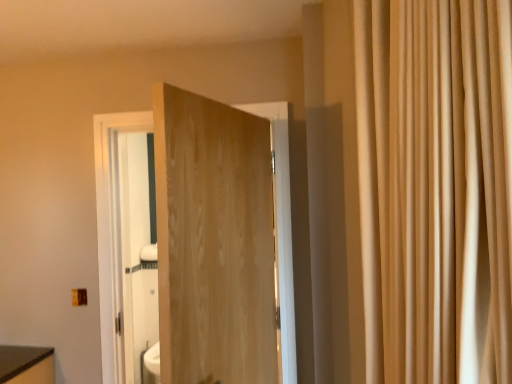
Question: From a real-world perspective, relative to natural wood door at center, is beige fabric curtain at right vertically above or below?

Choices:
 (A) above
 (B) below

Answer: (A)

Question: From the image's perspective, is beige fabric curtain at right positioned above or below natural wood door at center?

Choices:
 (A) above
 (B) below

Answer: (A)

Question: Is beige fabric curtain at right wider or thinner than natural wood door at center?

Choices:
 (A) wide
 (B) thin

Answer: (A)

Question: From a real-world perspective, is natural wood door at center above or below beige fabric curtain at right?

Choices:
 (A) above
 (B) below

Answer: (B)

Question: Considering the positions of natural wood door at center and beige fabric curtain at right in the image, is natural wood door at center bigger or smaller than beige fabric curtain at right?

Choices:
 (A) small
 (B) big

Answer: (A)

Question: Is point (279, 172) closer or farther from the camera than point (368, 97)?

Choices:
 (A) farther
 (B) closer

Answer: (A)

Question: Choose the correct answer: Is natural wood door at center inside beige fabric curtain at right or outside it?

Choices:
 (A) outside
 (B) inside

Answer: (A)